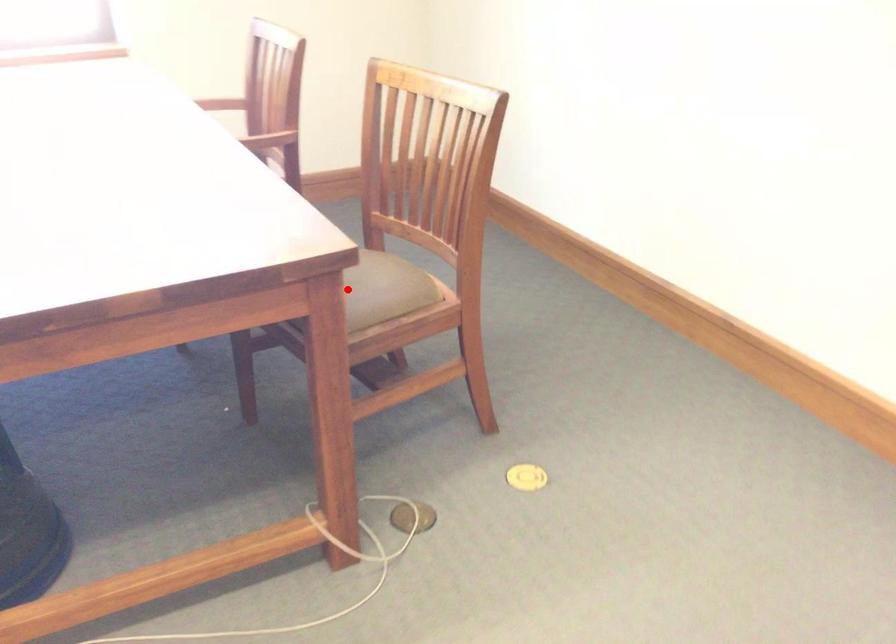
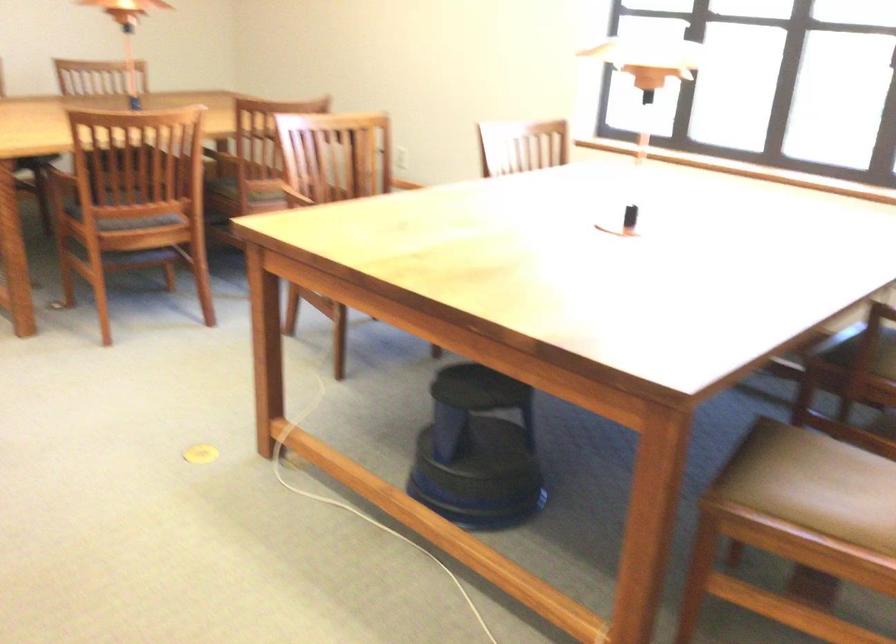
Question: I am providing you with two images of the same scene from different viewpoints. A red point is shown in image1. For the corresponding object point in image2, is it positioned nearer or farther from the camera?

Choices:
 (A) Nearer
 (B) Farther

Answer: (A)